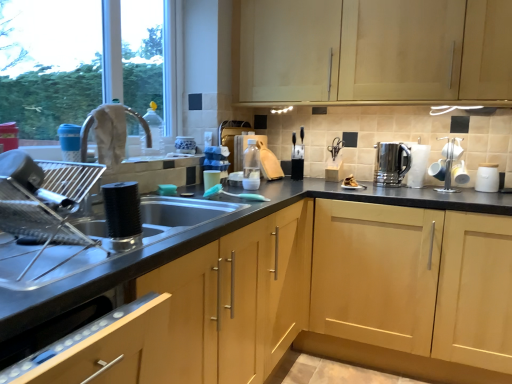
Question: Does silver metallic toaster at upper right, the 4th appliance when ordered from front to back, lie in front of white matte jar at right, the first appliance in the right-to-left sequence?

Choices:
 (A) yes
 (B) no

Answer: (B)

Question: Considering the relative positions of silver metallic toaster at upper right, the 2th appliance from the left, and white matte jar at right, the fourth appliance viewed from the left, in the image provided, is silver metallic toaster at upper right, the 2th appliance from the left, to the left of white matte jar at right, the fourth appliance viewed from the left, from the viewer's perspective?

Choices:
 (A) no
 (B) yes

Answer: (B)

Question: Is silver metallic toaster at upper right, which ranks as the third appliance in right-to-left order, not close to white matte jar at right, the third appliance viewed from the front?

Choices:
 (A) yes
 (B) no

Answer: (B)

Question: Does silver metallic toaster at upper right, the 2th appliance from the left, have a smaller size compared to white matte jar at right, the third appliance viewed from the front?

Choices:
 (A) no
 (B) yes

Answer: (A)

Question: Can you confirm if silver metallic toaster at upper right, the 4th appliance when ordered from front to back, is shorter than white matte jar at right, the first appliance in the right-to-left sequence?

Choices:
 (A) yes
 (B) no

Answer: (B)

Question: Could you tell me if silver metallic toaster at upper right, the 4th appliance when ordered from front to back, is turned towards white matte jar at right, the first appliance in the right-to-left sequence?

Choices:
 (A) yes
 (B) no

Answer: (B)

Question: From the image's perspective, is matte plastic cup at sink, which appears as the 4th appliance when viewed from the back, below transparent plastic bottle at upper center, the 1th bottle positioned from the front?

Choices:
 (A) yes
 (B) no

Answer: (A)

Question: Considering the relative positions of matte plastic cup at sink, the fourth appliance from the right, and transparent plastic bottle at upper center, the 1th bottle positioned from the front, in the image provided, is matte plastic cup at sink, the fourth appliance from the right, behind transparent plastic bottle at upper center, the 1th bottle positioned from the front,?

Choices:
 (A) yes
 (B) no

Answer: (B)

Question: Can you confirm if matte plastic cup at sink, the 1th appliance positioned from the left, is smaller than transparent plastic bottle at upper center, which is counted as the 2th bottle, starting from the back?

Choices:
 (A) yes
 (B) no

Answer: (A)

Question: From a real-world perspective, is matte plastic cup at sink, the fourth appliance from the right, positioned under transparent plastic bottle at upper center, which is the first bottle from left to right, based on gravity?

Choices:
 (A) no
 (B) yes

Answer: (B)

Question: Can you confirm if matte plastic cup at sink, the 1th appliance positioned from the left, is shorter than transparent plastic bottle at upper center, which is the first bottle from left to right?

Choices:
 (A) no
 (B) yes

Answer: (B)

Question: Can transparent plastic bottle at upper center, the 1th bottle positioned from the front, be found inside matte plastic cup at sink, the fourth appliance from the right?

Choices:
 (A) yes
 (B) no

Answer: (B)

Question: Can you confirm if transparent plastic bottle at upper center, which is the first bottle from left to right, is smaller than stainless steel kettle at right?

Choices:
 (A) no
 (B) yes

Answer: (B)